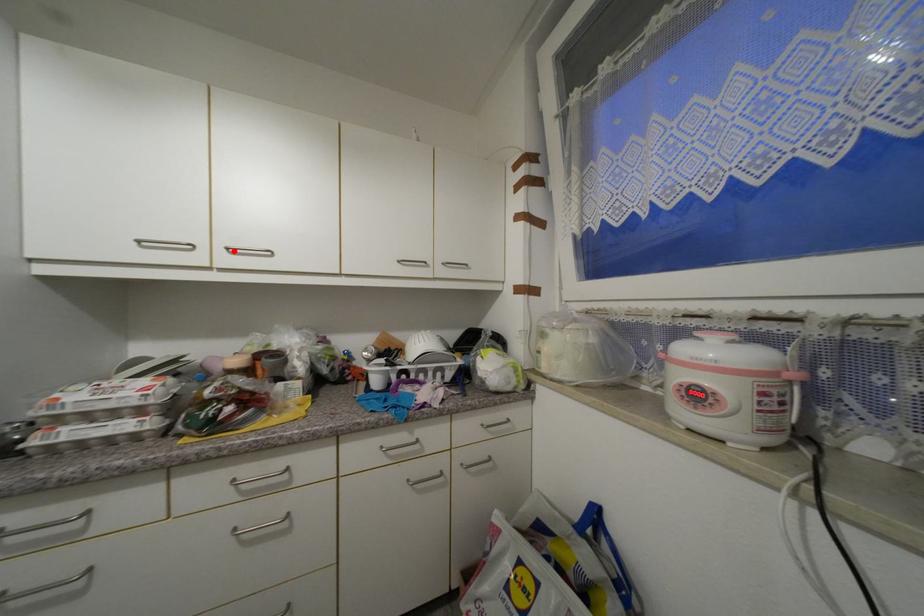
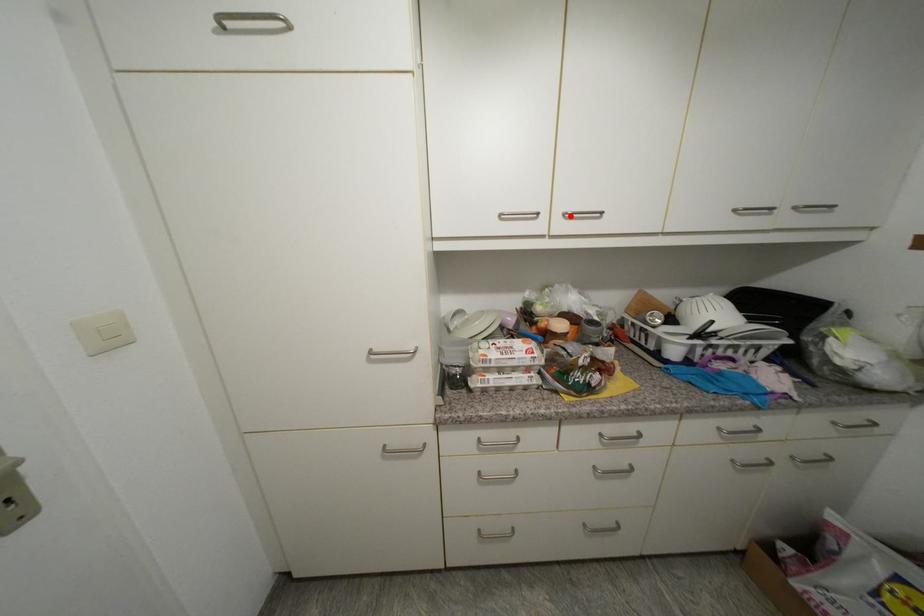
I am providing you with two images of the same scene from different viewpoints. A red point is marked on the first image and another point is marked on the second image. Does the point marked in image1 correspond to the same location as the one in image2?

Yes